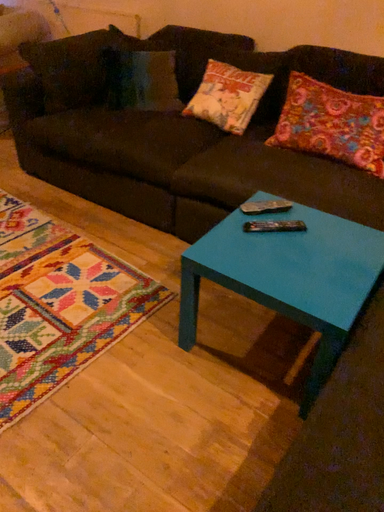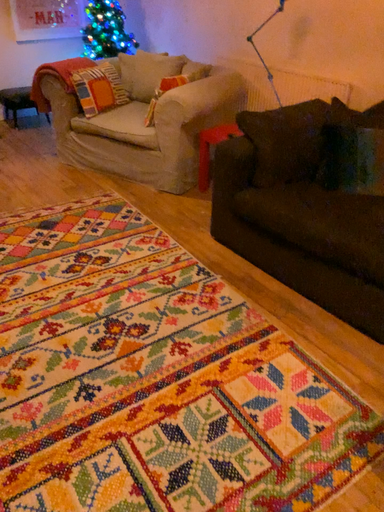
Question: How did the camera likely rotate when shooting the video?

Choices:
 (A) rotated right
 (B) rotated left

Answer: (B)